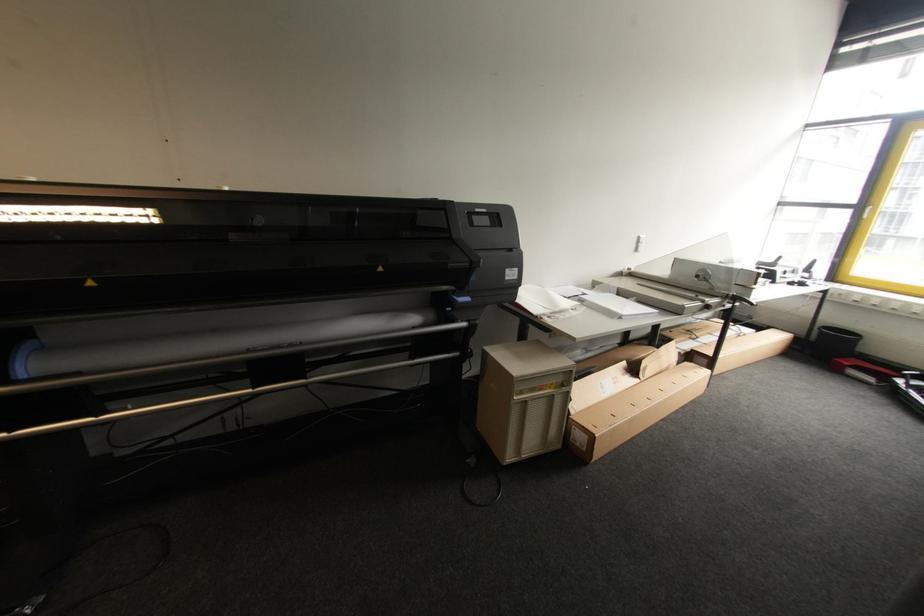
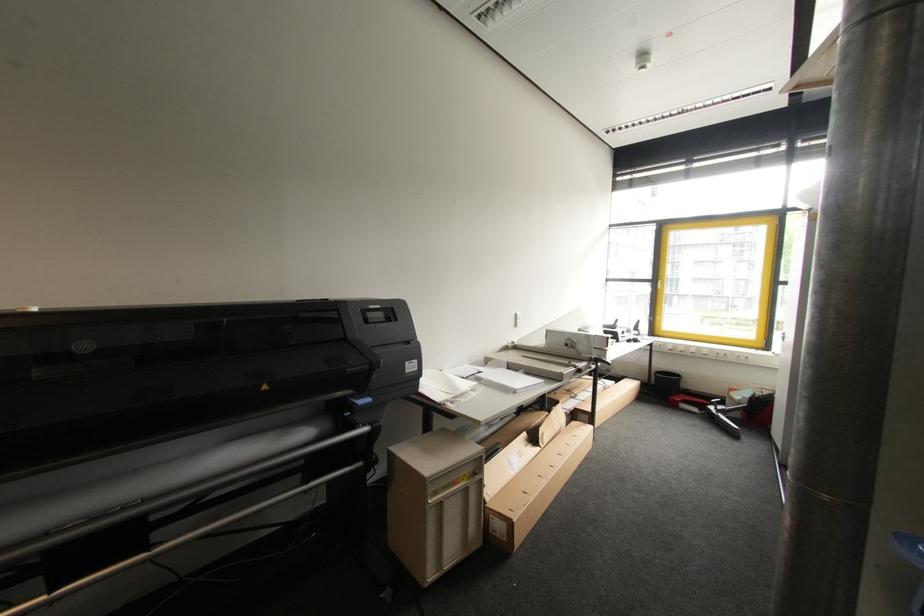
Locate, in the second image, the point that corresponds to point 874,381 in the first image.

(699, 411)